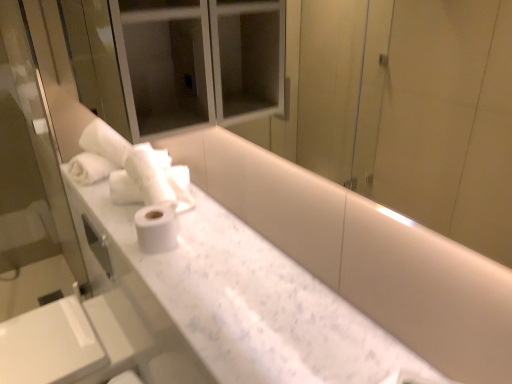
Question: From a real-world perspective, is white soft towel at upper left physically above white matte toilet paper at center?

Choices:
 (A) no
 (B) yes

Answer: (B)

Question: Considering the relative sizes of white soft towel at upper left and white matte toilet paper at center in the image provided, is white soft towel at upper left taller than white matte toilet paper at center?

Choices:
 (A) no
 (B) yes

Answer: (B)

Question: Does white soft towel at upper left appear on the right side of white matte toilet paper at center?

Choices:
 (A) no
 (B) yes

Answer: (A)

Question: Is the depth of white soft towel at upper left greater than that of white matte toilet paper at center?

Choices:
 (A) yes
 (B) no

Answer: (A)

Question: From the image's perspective, is white soft towel at upper left on top of white matte toilet paper at center?

Choices:
 (A) yes
 (B) no

Answer: (A)

Question: From the image's perspective, is white marble sink at lower left located above or below white matte toilet paper at center?

Choices:
 (A) below
 (B) above

Answer: (A)

Question: Considering the relative positions of white marble sink at lower left and white matte toilet paper at center in the image provided, is white marble sink at lower left to the left or to the right of white matte toilet paper at center?

Choices:
 (A) left
 (B) right

Answer: (A)

Question: Which is correct: white marble sink at lower left is inside white matte toilet paper at center, or outside of it?

Choices:
 (A) inside
 (B) outside

Answer: (B)

Question: Is white marble sink at lower left wider or thinner than white matte toilet paper at center?

Choices:
 (A) thin
 (B) wide

Answer: (B)

Question: Does point (245, 246) appear closer or farther from the camera than point (159, 243)?

Choices:
 (A) closer
 (B) farther

Answer: (B)

Question: In the image, is white marble counter at center positioned in front of or behind white matte toilet paper at center?

Choices:
 (A) behind
 (B) front

Answer: (B)

Question: In terms of size, does white marble counter at center appear bigger or smaller than white matte toilet paper at center?

Choices:
 (A) small
 (B) big

Answer: (B)

Question: From a real-world perspective, relative to white matte toilet paper at center, is white marble counter at center vertically above or below?

Choices:
 (A) below
 (B) above

Answer: (A)

Question: Would you say white marble counter at center is to the left or to the right of white soft towel at upper left in the picture?

Choices:
 (A) left
 (B) right

Answer: (B)

Question: Is white marble counter at center situated inside white soft towel at upper left or outside?

Choices:
 (A) outside
 (B) inside

Answer: (A)